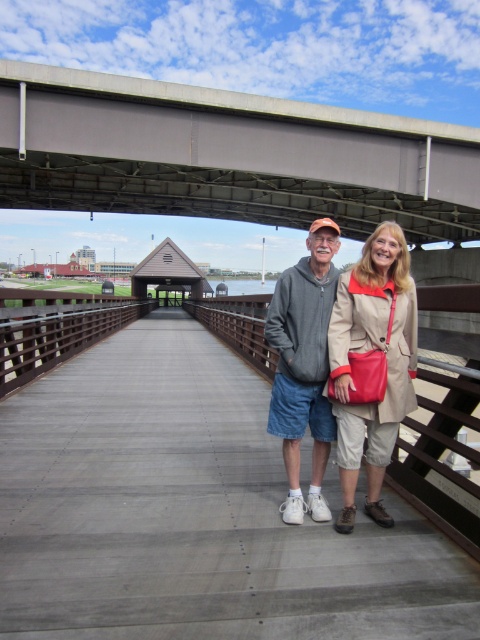
You are a photographer trying to capture both the concrete bridge at upper center and the beige textured coat at center in a single frame. Based on their sizes, which object should you focus on to ensure both fit in the photo?

The concrete bridge at upper center is larger in size than the beige textured coat at center, so you should focus on the concrete bridge at upper center to ensure both fit in the photo.

You are a photographer trying to capture a closeup shot of both the beige textured coat at center and the gray fleece jacket at center. Given that your camera can only focus on objects within a 10 inch range, will you be able to capture both in focus?

The beige textured coat at center and the gray fleece jacket at center are 10.57 inches apart from each other. Since the distance between them exceeds the camera focus range of 10 inches, you will not be able to capture both in focus simultaneously.

You are a photographer trying to capture a photo of the concrete bridge at upper center and the beige textured coat at center. Based on their positions, which object should you focus on first to ensure both are in frame?

The concrete bridge at upper center should be focused on first because it is positioned to the right of the beige textured coat at center, so adjusting the frame to include the right side ensures both are captured.